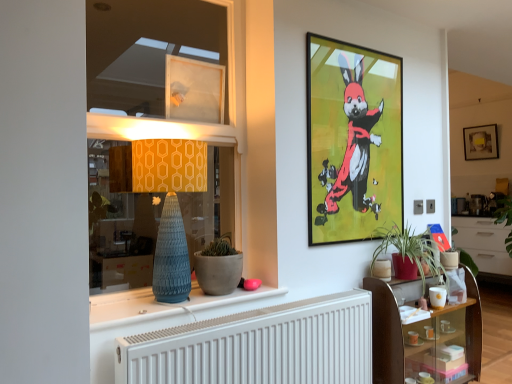
Question: Is metallic-framed artwork at upper center, positioned as the 2th picture frame in right-to-left order, shorter than transparent plastic window at upper center, the third picture frame in the right-to-left sequence?

Choices:
 (A) no
 (B) yes

Answer: (A)

Question: Can you confirm if metallic-framed artwork at upper center, the 2th picture frame from the front, is bigger than transparent plastic window at upper center, acting as the first picture frame starting from the front?

Choices:
 (A) no
 (B) yes

Answer: (B)

Question: Can you confirm if metallic-framed artwork at upper center, which is the second picture frame in left-to-right order, is thinner than transparent plastic window at upper center, the third picture frame in the right-to-left sequence?

Choices:
 (A) no
 (B) yes

Answer: (B)

Question: Could transparent plastic window at upper center, which is the 1th picture frame from left to right, be considered to be inside metallic-framed artwork at upper center, which is the second picture frame in left-to-right order?

Choices:
 (A) yes
 (B) no

Answer: (B)

Question: Would you say metallic-framed artwork at upper center, which is the second picture frame in left-to-right order, is outside transparent plastic window at upper center, acting as the 3th picture frame starting from the back?

Choices:
 (A) yes
 (B) no

Answer: (A)

Question: Visually, is wooden glass shelf at lower right positioned to the left or to the right of matte yellow fabric at left?

Choices:
 (A) left
 (B) right

Answer: (B)

Question: From their relative heights in the image, would you say wooden glass shelf at lower right is taller or shorter than matte yellow fabric at left?

Choices:
 (A) short
 (B) tall

Answer: (A)

Question: Is wooden glass shelf at lower right bigger or smaller than matte yellow fabric at left?

Choices:
 (A) small
 (B) big

Answer: (A)

Question: Considering their positions, is wooden glass shelf at lower right located in front of or behind matte yellow fabric at left?

Choices:
 (A) behind
 (B) front

Answer: (A)

Question: From the image's perspective, relative to matte concrete pot at center, positioned as the 1th flowerpot in front-to-back order, is matte blue vase at center above or below?

Choices:
 (A) above
 (B) below

Answer: (B)

Question: Is matte blue vase at center to the left or to the right of matte concrete pot at center, which appears as the 2th flowerpot when viewed from the back, in the image?

Choices:
 (A) left
 (B) right

Answer: (A)

Question: Is point (212, 311) closer or farther from the camera than point (230, 284)?

Choices:
 (A) closer
 (B) farther

Answer: (A)

Question: Is matte blue vase at center inside or outside of matte concrete pot at center, acting as the 1th flowerpot starting from the left?

Choices:
 (A) outside
 (B) inside

Answer: (A)

Question: Looking at their shapes, would you say matte blue vase at center is wider or thinner than matte yellow fabric at left?

Choices:
 (A) wide
 (B) thin

Answer: (A)

Question: In the image, is matte blue vase at center positioned in front of or behind matte yellow fabric at left?

Choices:
 (A) behind
 (B) front

Answer: (B)